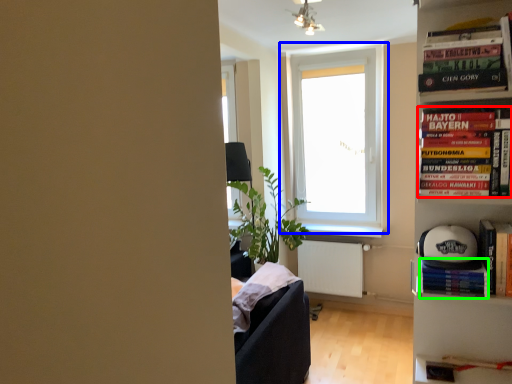
Question: Considering the real-world distances, which object is farthest from book (highlighted by a red box)? window (highlighted by a blue box) or paperback book (highlighted by a green box)?

Choices:
 (A) window
 (B) paperback book

Answer: (A)